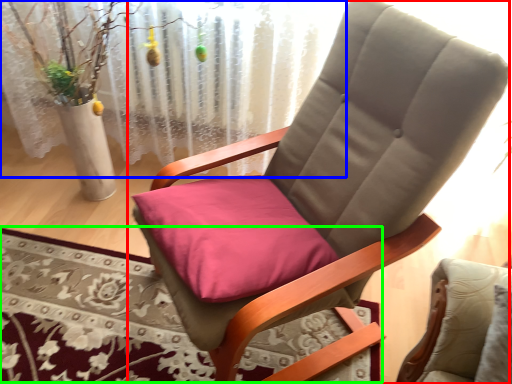
Question: Based on their relative distances, which object is farther from chair (highlighted by a red box)? Choose from curtain (highlighted by a blue box) and mat (highlighted by a green box).

Choices:
 (A) curtain
 (B) mat

Answer: (A)